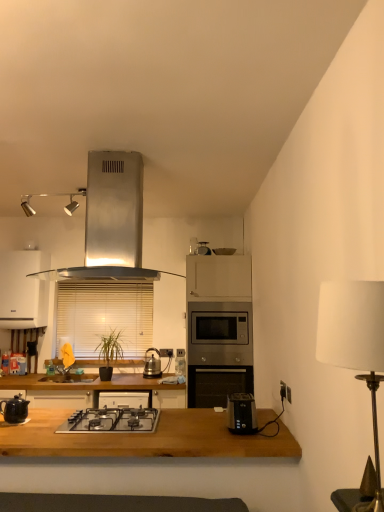
Question: Is black plastic toaster at lower center bigger than wooden blinds at center?

Choices:
 (A) yes
 (B) no

Answer: (B)

Question: Is black plastic toaster at lower center not within wooden blinds at center?

Choices:
 (A) no
 (B) yes

Answer: (B)

Question: Can you confirm if black plastic toaster at lower center is wider than wooden blinds at center?

Choices:
 (A) no
 (B) yes

Answer: (B)

Question: From the image's perspective, does black plastic toaster at lower center appear higher than wooden blinds at center?

Choices:
 (A) yes
 (B) no

Answer: (B)

Question: Is wooden blinds at center completely or partially inside black plastic toaster at lower center?

Choices:
 (A) yes
 (B) no

Answer: (B)

Question: Considering the relative positions of wooden blinds at center and matte black kettle at left, which is counted as the 3th kitchen appliance, starting from the right, in the image provided, is wooden blinds at center to the left or to the right of matte black kettle at left, which is counted as the 3th kitchen appliance, starting from the right,?

Choices:
 (A) left
 (B) right

Answer: (B)

Question: In terms of size, does wooden blinds at center appear bigger or smaller than matte black kettle at left, which appears as the 2th kitchen appliance when ordered from the bottom?

Choices:
 (A) big
 (B) small

Answer: (A)

Question: From a real-world perspective, is wooden blinds at center positioned above or below matte black kettle at left, which ranks as the second kitchen appliance in front-to-back order?

Choices:
 (A) above
 (B) below

Answer: (A)

Question: In terms of height, does wooden blinds at center look taller or shorter compared to matte black kettle at left, which appears as the 2th kitchen appliance when ordered from the bottom?

Choices:
 (A) short
 (B) tall

Answer: (B)

Question: In the image, is wooden table at center on the left side or the right side of black plastic electric outlet at right, which ranks as the first electric outlet in right-to-left order?

Choices:
 (A) right
 (B) left

Answer: (B)

Question: Looking at their shapes, would you say wooden table at center is wider or thinner than black plastic electric outlet at right, the 2th electric outlet from the back?

Choices:
 (A) thin
 (B) wide

Answer: (B)

Question: Considering the positions of point (276, 455) and point (281, 392), is point (276, 455) closer or farther from the camera than point (281, 392)?

Choices:
 (A) farther
 (B) closer

Answer: (B)

Question: From a real-world perspective, is wooden table at center positioned above or below black plastic electric outlet at right, the 2th electric outlet from the back?

Choices:
 (A) below
 (B) above

Answer: (A)

Question: Considering the positions of matte black kettle at left, which appears as the 2th kitchen appliance when ordered from the bottom, and white plastic electric outlet at center, which is the 3th electric outlet in right-to-left order, in the image, is matte black kettle at left, which appears as the 2th kitchen appliance when ordered from the bottom, wider or thinner than white plastic electric outlet at center, which is the 3th electric outlet in right-to-left order,?

Choices:
 (A) wide
 (B) thin

Answer: (A)

Question: Is matte black kettle at left, which ranks as the second kitchen appliance in front-to-back order, in front of or behind white plastic electric outlet at center, the 1th electric outlet positioned from the back, in the image?

Choices:
 (A) behind
 (B) front

Answer: (B)